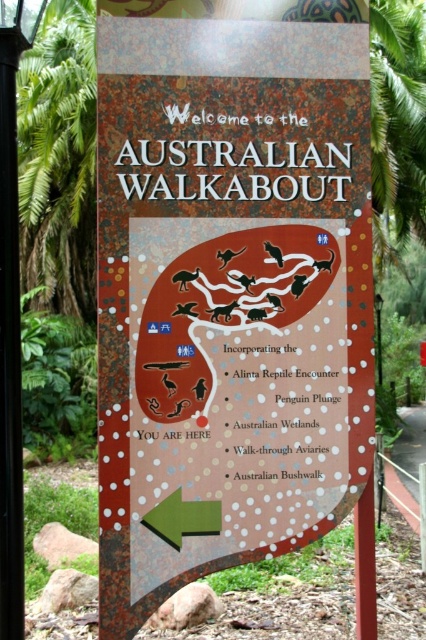
I want to click on rustic wooden sign at center, so [229, 291].

Between rustic wooden sign at center and black metal pole at left, which one is positioned higher?

black metal pole at left

At what (x,y) coordinates should I click in order to perform the action: click on rustic wooden sign at center. Please return your answer as a coordinate pair (x, y). This screenshot has height=640, width=426. Looking at the image, I should click on (229, 291).

This screenshot has width=426, height=640. Identify the location of rustic wooden sign at center. (229, 291).